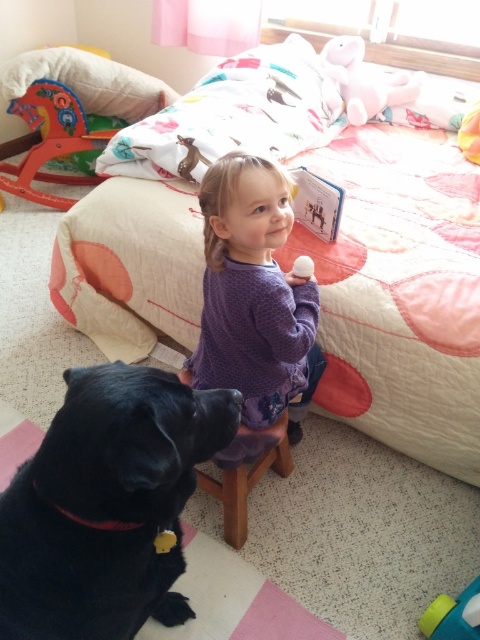
Question: Can you confirm if floral quilted bed at center is positioned above wooden stool at lower center?

Choices:
 (A) yes
 (B) no

Answer: (A)

Question: Considering the relative positions of floral quilted bed at center and wooden stool at lower center in the image provided, where is floral quilted bed at center located with respect to wooden stool at lower center?

Choices:
 (A) right
 (B) left

Answer: (A)

Question: Which of the following is the closest to the observer?

Choices:
 (A) purple dotted sweater at center
 (B) floral quilted bed at center
 (C) wooden stool at lower center
 (D) pink plush bear at upper center

Answer: (A)

Question: Which point appears farthest from the camera in this image?

Choices:
 (A) (471, 244)
 (B) (307, 257)

Answer: (A)

Question: Which point appears farthest from the camera in this image?

Choices:
 (A) (450, 611)
 (B) (412, 116)

Answer: (B)

Question: Does floral quilted bed at center appear on the left side of purple dotted sweater at center?

Choices:
 (A) yes
 (B) no

Answer: (B)